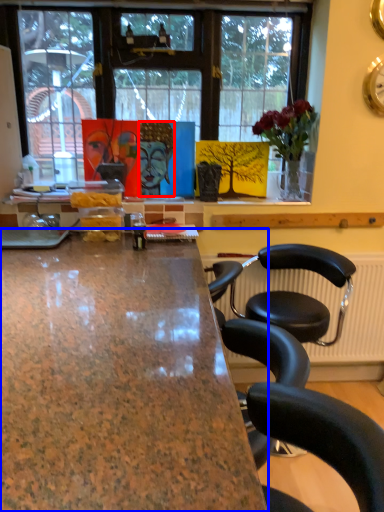
Question: Among these objects, which one is farthest to the camera, person (highlighted by a red box) or desk (highlighted by a blue box)?

Choices:
 (A) person
 (B) desk

Answer: (A)